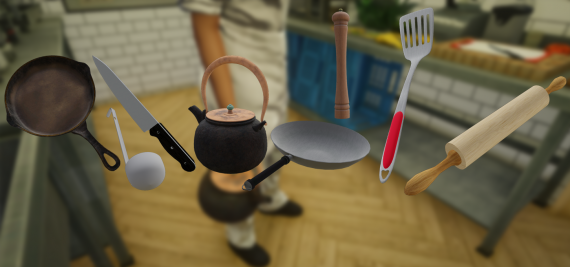
Locate an element on the screen. stove is located at coordinates (27, 53).